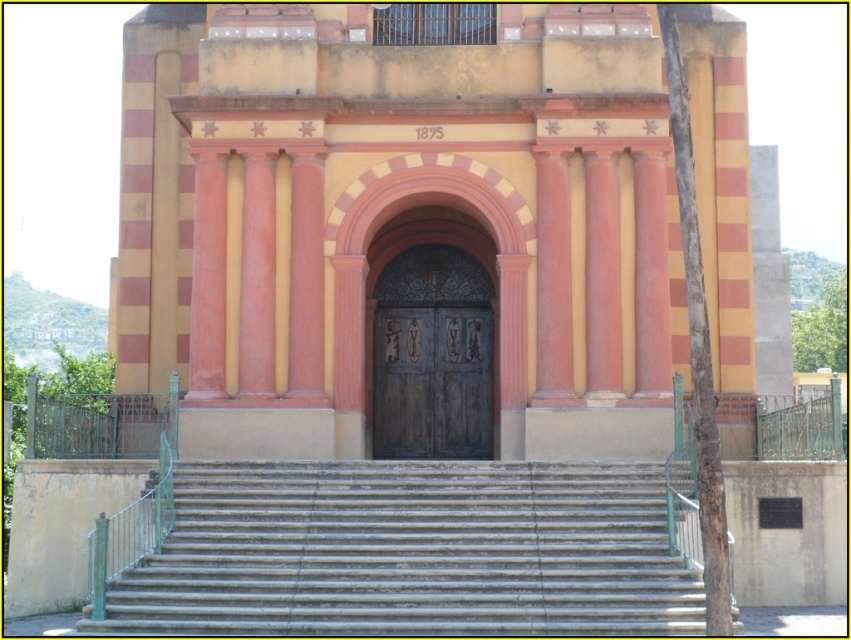
You are standing at the bottom of the smooth concrete stairs at lower center and want to reach the dark brown wooden door at center. Which direction should you move to get closer to the door?

To reach the dark brown wooden door at center from the smooth concrete stairs at lower center, you should move upward since the stairs are positioned below the door.

You are a delivery person carrying a large package and need to approach the dark brown wooden door at center. The package is too wide to fit through the door. Can you place it on the smooth concrete stairs at lower center instead?

The smooth concrete stairs at lower center might be wider than the dark brown wooden door at center, so placing the package there could be possible if the stairs are indeed wider. However, the exact width isn not specified, so it depends on the actual measurement.